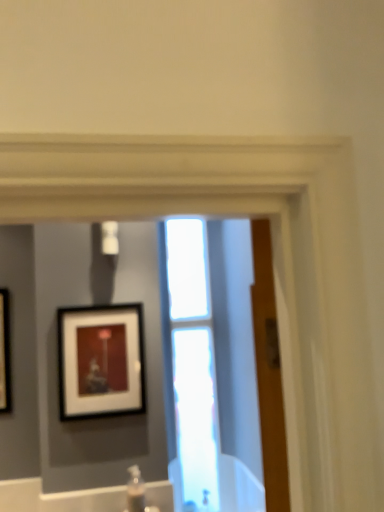
Question: Considering the relative positions of clear plastic bottle at lower center and transparent glass window at center in the image provided, is clear plastic bottle at lower center behind transparent glass window at center?

Choices:
 (A) yes
 (B) no

Answer: (B)

Question: From a real-world perspective, does clear plastic bottle at lower center stand above transparent glass window at center?

Choices:
 (A) yes
 (B) no

Answer: (B)

Question: Is clear plastic bottle at lower center in front of transparent glass window at center?

Choices:
 (A) yes
 (B) no

Answer: (A)

Question: From a real-world perspective, is clear plastic bottle at lower center located beneath transparent glass window at center?

Choices:
 (A) yes
 (B) no

Answer: (A)

Question: Could you tell me if clear plastic bottle at lower center is facing transparent glass window at center?

Choices:
 (A) no
 (B) yes

Answer: (A)

Question: Looking at their shapes, would you say clear plastic bottle at lower center is wider or thinner than matte black picture frame at upper left?

Choices:
 (A) wide
 (B) thin

Answer: (A)

Question: From the image's perspective, is clear plastic bottle at lower center above or below matte black picture frame at upper left?

Choices:
 (A) above
 (B) below

Answer: (B)

Question: Considering the positions of clear plastic bottle at lower center and matte black picture frame at upper left in the image, is clear plastic bottle at lower center bigger or smaller than matte black picture frame at upper left?

Choices:
 (A) big
 (B) small

Answer: (B)

Question: Is clear plastic bottle at lower center in front of or behind matte black picture frame at upper left in the image?

Choices:
 (A) front
 (B) behind

Answer: (A)

Question: Considering the positions of transparent glass window at center and clear plastic bottle at lower center in the image, is transparent glass window at center wider or thinner than clear plastic bottle at lower center?

Choices:
 (A) thin
 (B) wide

Answer: (A)

Question: From the image's perspective, is transparent glass window at center above or below clear plastic bottle at lower center?

Choices:
 (A) above
 (B) below

Answer: (A)

Question: Is transparent glass window at center bigger or smaller than clear plastic bottle at lower center?

Choices:
 (A) big
 (B) small

Answer: (A)

Question: Is transparent glass window at center situated inside clear plastic bottle at lower center or outside?

Choices:
 (A) outside
 (B) inside

Answer: (A)

Question: From their relative heights in the image, would you say clear plastic bottle at lower center is taller or shorter than transparent glass window at center?

Choices:
 (A) short
 (B) tall

Answer: (A)

Question: Would you say clear plastic bottle at lower center is inside or outside transparent glass window at center?

Choices:
 (A) outside
 (B) inside

Answer: (A)